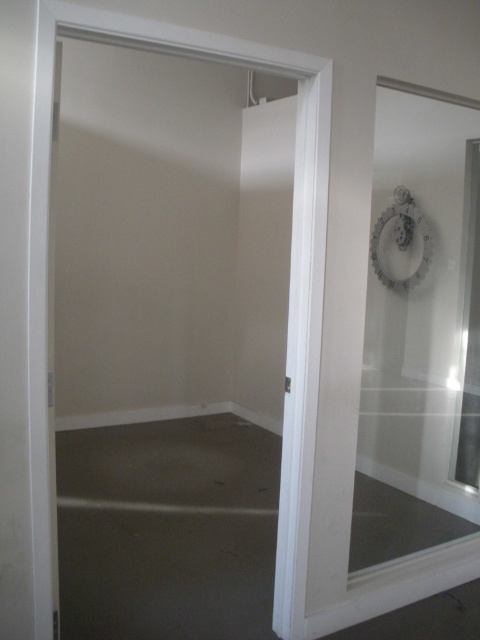
Is white matte door at center positioned in front of matte white mirror at upper right?

Yes, white matte door at center is closer to the viewer.

In the scene shown: Is white matte door at center to the left of matte white mirror at upper right from the viewer's perspective?

Correct, you'll find white matte door at center to the left of matte white mirror at upper right.

Which is behind, point (85, 12) or point (381, 230)?

The point (381, 230) is behind.

Locate an element on the screen. white matte door at center is located at coordinates pos(289,268).

Which is more to the left, transparent glass door at center or matte white mirror at upper right?

transparent glass door at center

Who is shorter, transparent glass door at center or matte white mirror at upper right?

Standing shorter between the two is matte white mirror at upper right.

Measure the distance between transparent glass door at center and camera.

The distance of transparent glass door at center from camera is 7.19 feet.

Where is `transparent glass door at center`? transparent glass door at center is located at coordinates (397, 584).

Does white matte door at center appear on the right side of transparent glass door at center?

In fact, white matte door at center is to the left of transparent glass door at center.

Who is positioned more to the right, white matte door at center or transparent glass door at center?

transparent glass door at center is more to the right.

Is point (72, 16) positioned in front of point (468, 572)?

Yes, it is.

Locate an element on the screen. The height and width of the screenshot is (640, 480). white matte door at center is located at coordinates (289, 268).